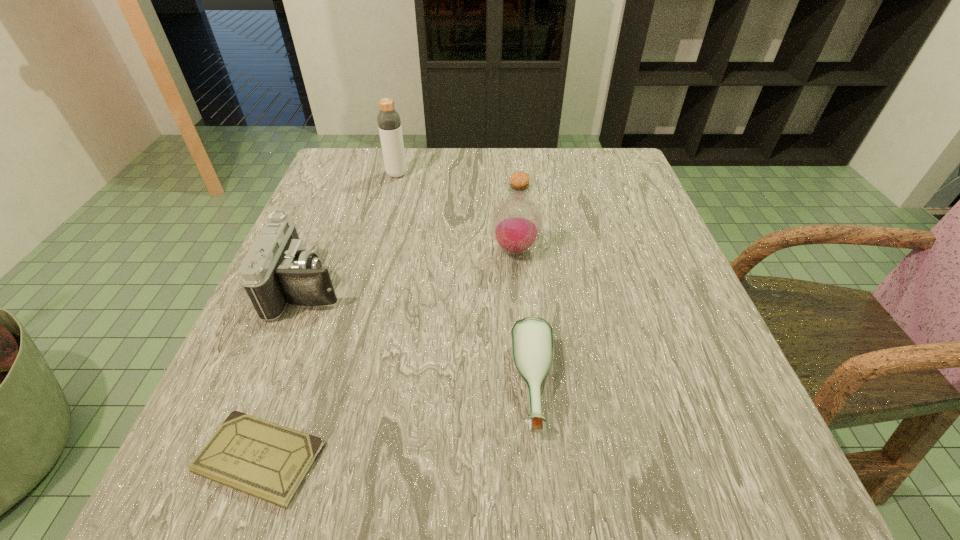
The image size is (960, 540). In the image, there is a desktop. Identify the location of vacant space at the near edge. (540, 455).

Find the location of a particular element. This screenshot has height=540, width=960. blank space at the left edge of the desktop is located at coordinates (319, 217).

Locate an element on the screen. This screenshot has width=960, height=540. vacant region at the right edge is located at coordinates (652, 347).

What are the coordinates of `vacant space at the far left corner of the desktop` in the screenshot? It's located at (380, 150).

In the image, there is a desktop. Where is `vacant area at the near left corner`? The width and height of the screenshot is (960, 540). vacant area at the near left corner is located at coordinates (300, 510).

Where is `free space between the second shortest object and the third tallest object`? free space between the second shortest object and the third tallest object is located at coordinates (420, 337).

The height and width of the screenshot is (540, 960). In order to click on empty location between the shortest object and the leftmost bottle in this screenshot , I will do tap(328, 316).

The image size is (960, 540). I want to click on free spot between the nearest bottle and the shortest object, so click(x=396, y=422).

Locate an element on the screen. This screenshot has height=540, width=960. vacant area between the farthest bottle and the second nearest bottle is located at coordinates (456, 212).

You are a GUI agent. You are given a task and a screenshot of the screen. Output one action in this format:
    pyautogui.click(x=<x>, y=<y>)
    Task: Click on the free spot between the fourth tallest object and the leftmost bottle
    This screenshot has width=960, height=540.
    Given the screenshot: What is the action you would take?
    pyautogui.click(x=465, y=280)